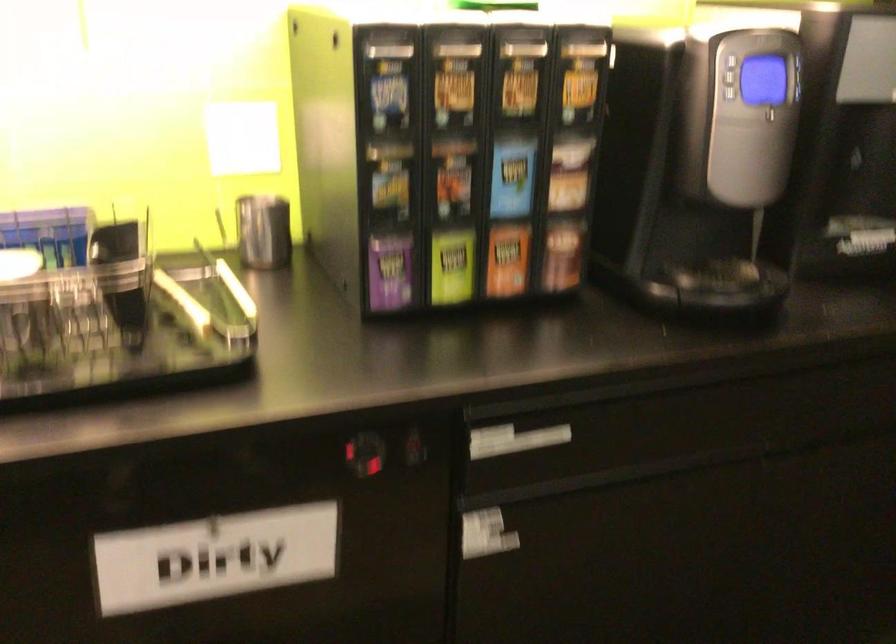
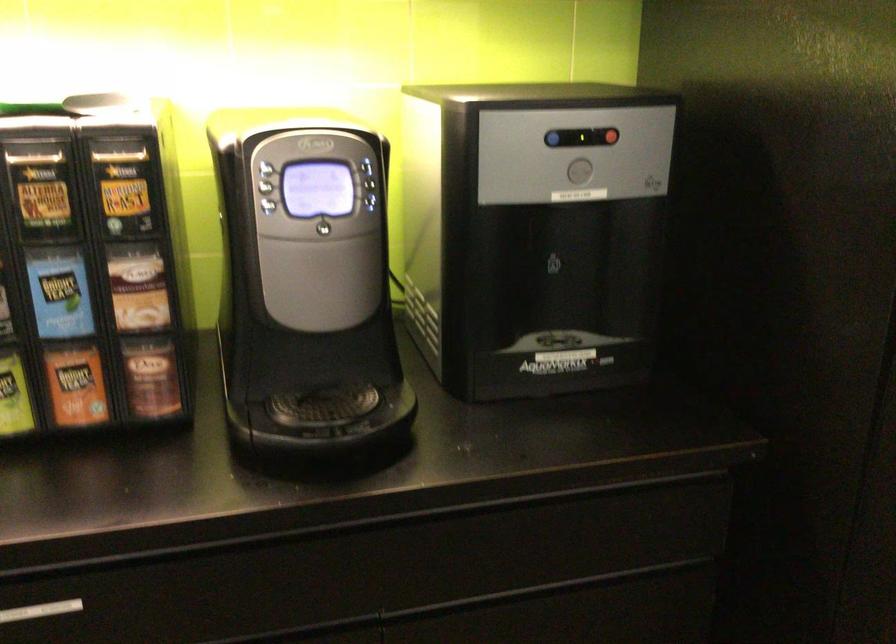
Locate, in the second image, the point that corresponds to pixel 803 93 in the first image.

(375, 204)